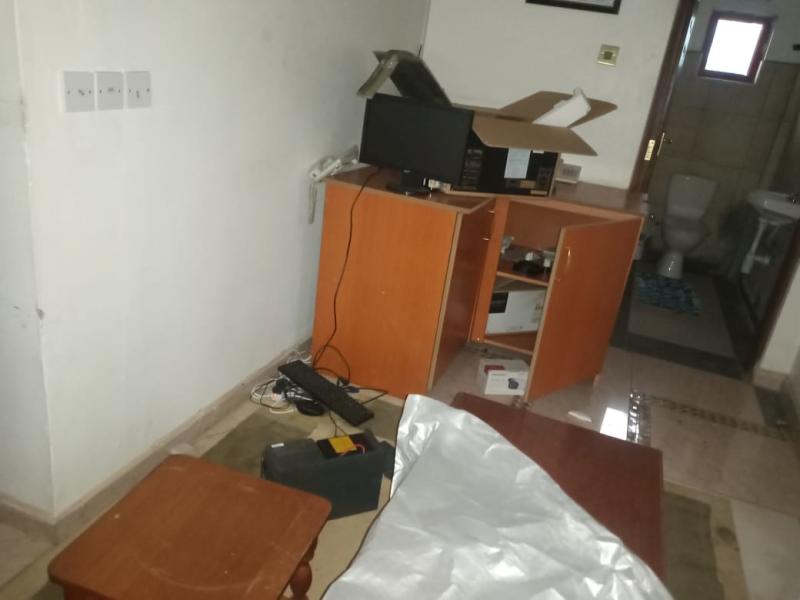
Where is `light switches`? This screenshot has height=600, width=800. light switches is located at coordinates (77, 98), (114, 98), (142, 93), (609, 47).